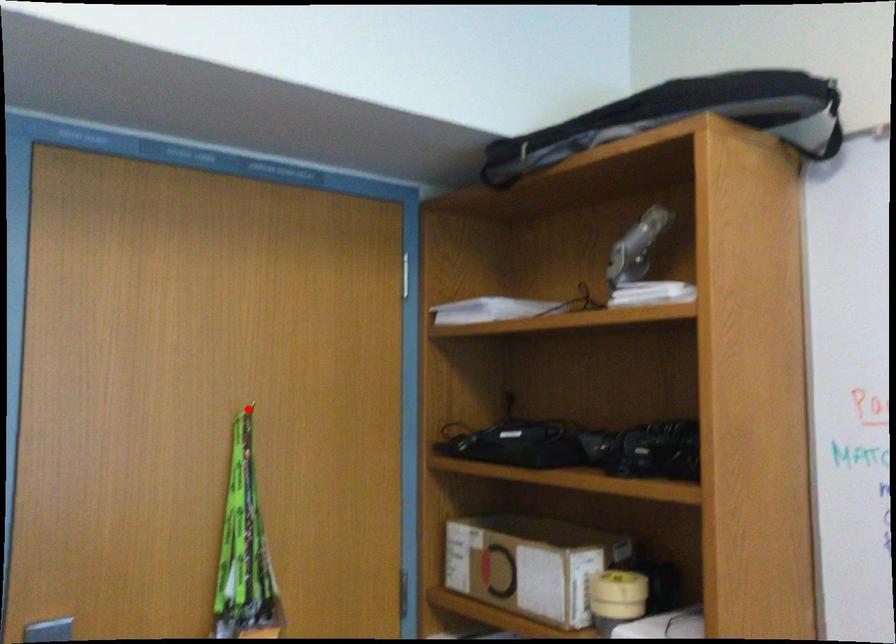
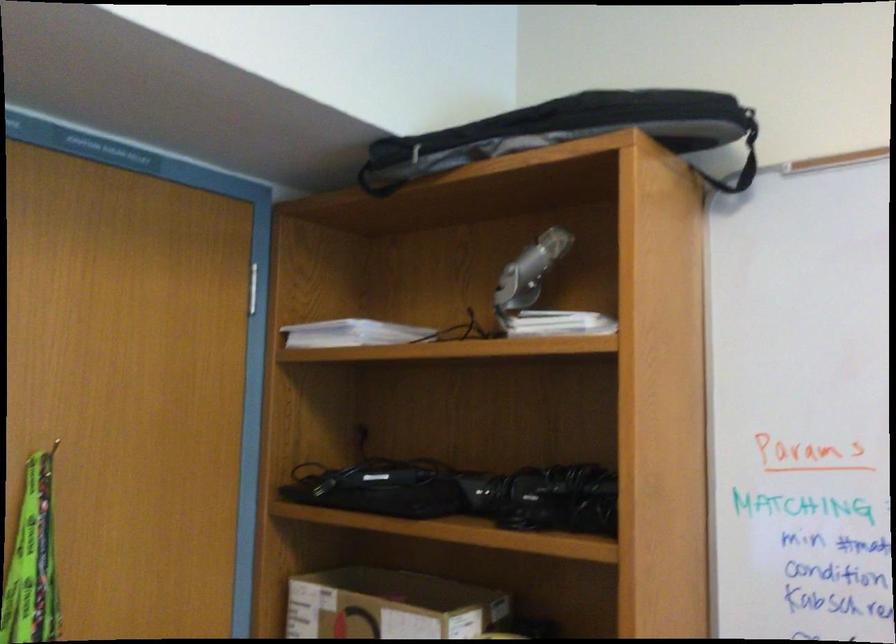
Question: I am providing you with two images of the same scene from different viewpoints. Given a red point in image1, look at the same physical point in image2. Is it:

Choices:
 (A) Closer to the viewpoint
 (B) Farther from the viewpoint

Answer: (A)